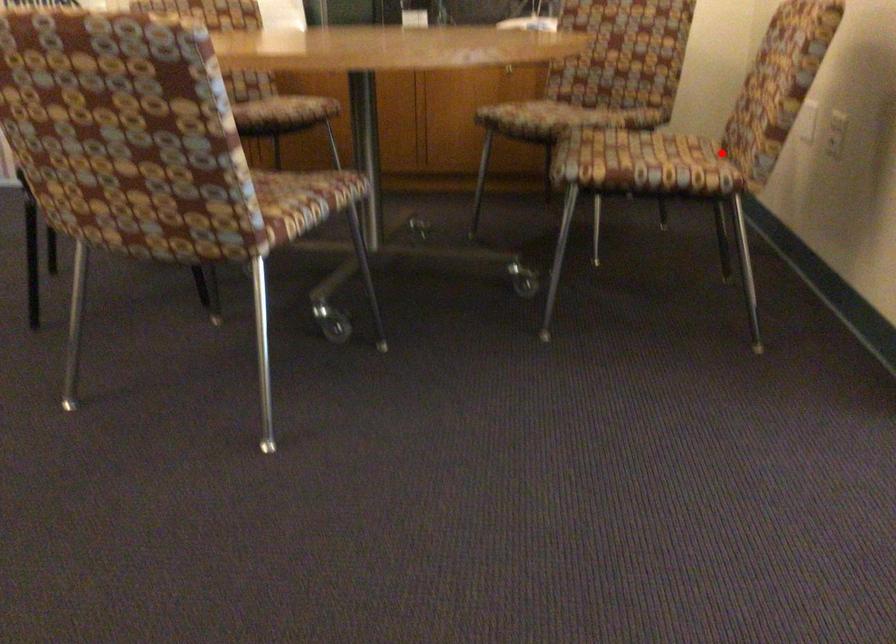
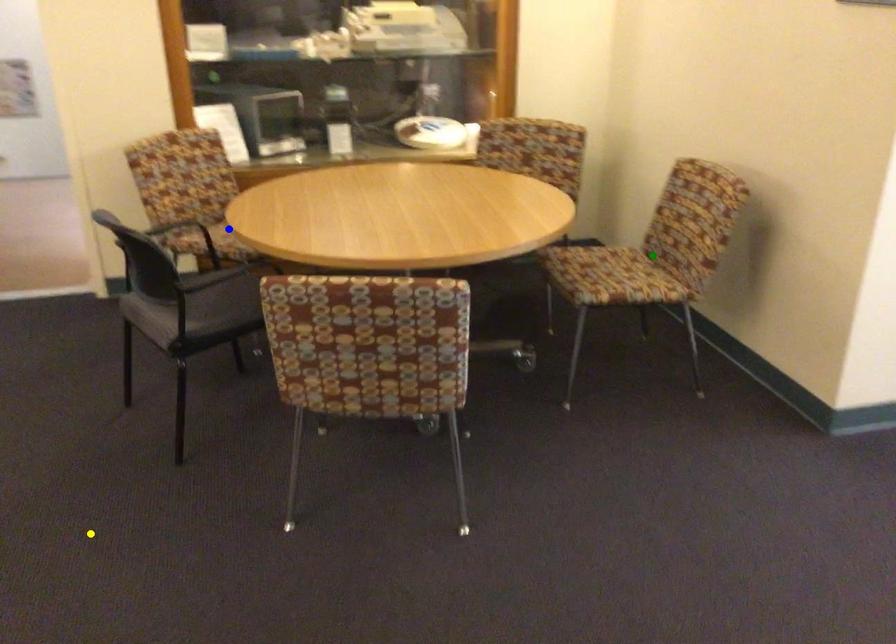
Question: I am providing you with two images of the same scene from different viewpoints. A red point is marked on the first image. You are given multiple points on the second image. Which point in image 2 is actually the same real-world point as the red point in image 1?

Choices:
 (A) green point
 (B) yellow point
 (C) blue point

Answer: (A)